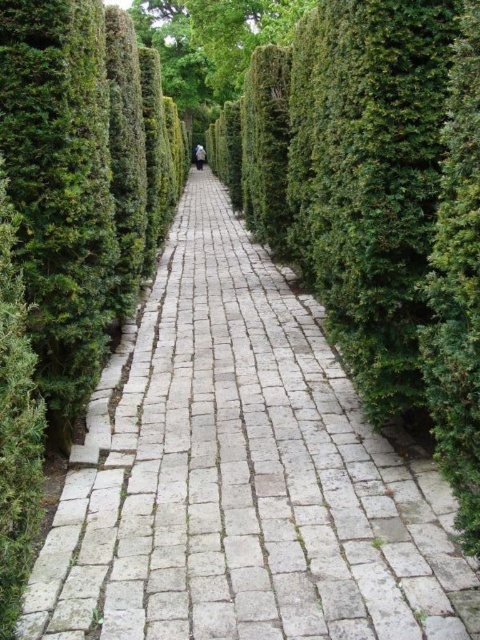
Where is `white stone pavement at center`? Image resolution: width=480 pixels, height=640 pixels. white stone pavement at center is located at coordinates (241, 476).

Between point (207, 456) and point (168, 88), which one is positioned in front?

Point (207, 456) is in front.

Identify the location of white stone pavement at center. (241, 476).